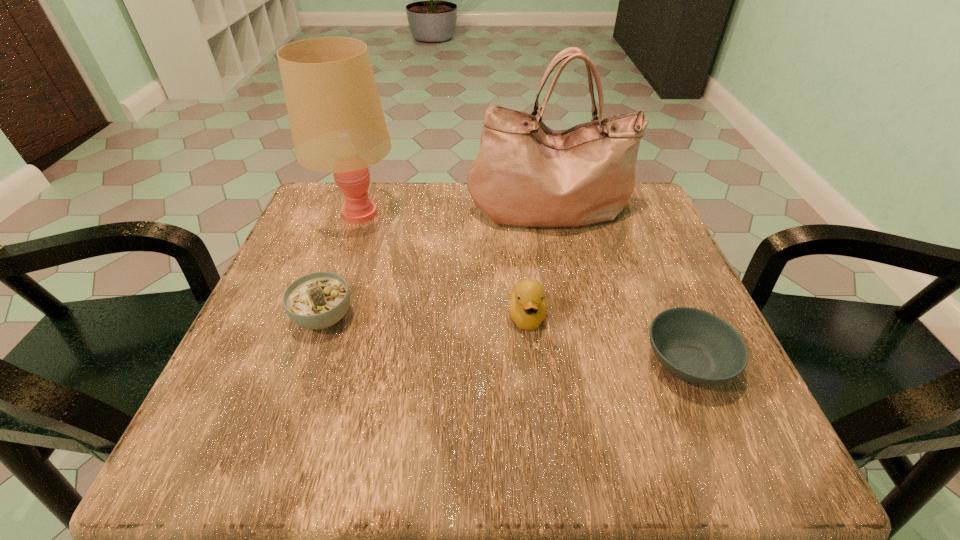
This screenshot has height=540, width=960. In order to click on free spot located 0.220m on the right of the left soup bowl in this screenshot , I will do `click(474, 317)`.

The image size is (960, 540). What are the coordinates of `vacant space situated 0.220m on the back of the shorter soup bowl` in the screenshot? It's located at (640, 250).

Where is `lampshade that is at the far edge`? Image resolution: width=960 pixels, height=540 pixels. lampshade that is at the far edge is located at coordinates (337, 122).

This screenshot has width=960, height=540. Find the location of `handbag that is at the far edge`. handbag that is at the far edge is located at coordinates (526, 174).

You are a GUI agent. You are given a task and a screenshot of the screen. Output one action in this format:
    pyautogui.click(x=<x>, y=<y>)
    Task: Click on the lampshade situated at the left edge
    
    Given the screenshot: What is the action you would take?
    pyautogui.click(x=337, y=122)

In order to click on soup bowl at the left edge in this screenshot , I will do `click(318, 300)`.

Locate an element on the screen. The height and width of the screenshot is (540, 960). handbag that is at the right edge is located at coordinates (526, 174).

Find the location of a particular element. This screenshot has width=960, height=540. soup bowl present at the right edge is located at coordinates (696, 346).

The height and width of the screenshot is (540, 960). In order to click on object that is at the far left corner in this screenshot , I will do `click(337, 122)`.

Locate an element on the screen. Image resolution: width=960 pixels, height=540 pixels. object situated at the far right corner is located at coordinates pos(526,174).